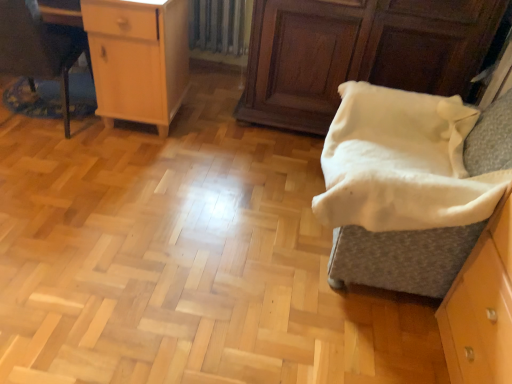
Question: In the image, is light wood cabinet at upper left positioned in front of or behind brushed metal desk at left?

Choices:
 (A) front
 (B) behind

Answer: (B)

Question: Is point (135, 34) closer or farther from the camera than point (47, 64)?

Choices:
 (A) closer
 (B) farther

Answer: (B)

Question: Which is nearer to the wooden cabinet at upper right?

Choices:
 (A) white soft blanket at right
 (B) light wood cabinet at upper left
 (C) brushed metal desk at left
 (D) metallic silver radiator at upper center

Answer: (A)

Question: Based on their relative distances, which object is farther from the light wood cabinet at upper left?

Choices:
 (A) white soft blanket at right
 (B) metallic silver radiator at upper center
 (C) brushed metal desk at left
 (D) wooden cabinet at upper right

Answer: (A)